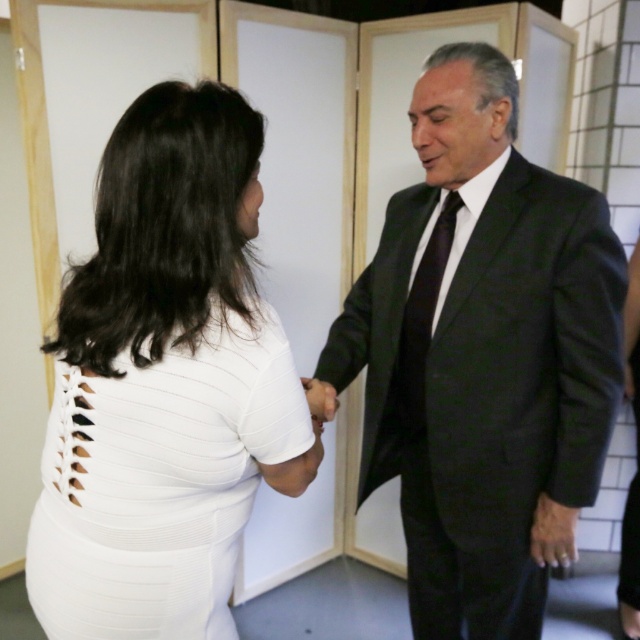
Who is higher up, dark gray suit at center or white matte hand at center?

dark gray suit at center is above.

Identify the location of dark gray suit at center. This screenshot has width=640, height=640. (483, 355).

The height and width of the screenshot is (640, 640). What are the coordinates of `dark gray suit at center` in the screenshot? It's located at (483, 355).

Locate an element on the screen. dark gray suit at center is located at coordinates (483, 355).

Can you confirm if dark gray suit at center is shorter than black silk tie at right?

No, dark gray suit at center is not shorter than black silk tie at right.

The image size is (640, 640). Describe the element at coordinates (483, 355) in the screenshot. I see `dark gray suit at center` at that location.

You are a GUI agent. You are given a task and a screenshot of the screen. Output one action in this format:
    pyautogui.click(x=<x>, y=<y>)
    Task: Click on the dark gray suit at center
    The image size is (640, 640).
    Given the screenshot: What is the action you would take?
    click(483, 355)

Between point (205, 134) and point (321, 390), which one is positioned behind?

Positioned behind is point (321, 390).

You are a GUI agent. You are given a task and a screenshot of the screen. Output one action in this format:
    pyautogui.click(x=<x>, y=<y>)
    Task: Click on the white textured dress at left
    Image resolution: width=640 pixels, height=640 pixels.
    Given the screenshot: What is the action you would take?
    pyautogui.click(x=164, y=384)

Where is `white textured dress at left`? This screenshot has height=640, width=640. white textured dress at left is located at coordinates (164, 384).